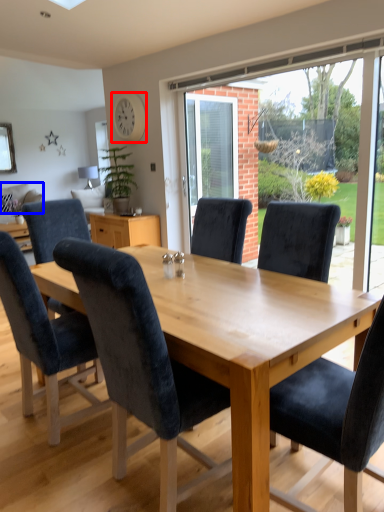
Question: Which object is closer to the camera taking this photo, clock (highlighted by a red box) or pillow (highlighted by a blue box)?

Choices:
 (A) clock
 (B) pillow

Answer: (A)